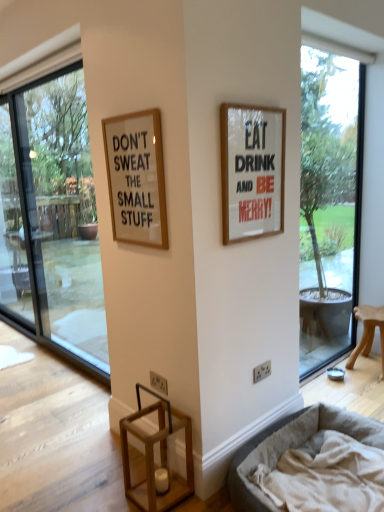
This screenshot has width=384, height=512. Identify the location of free location above transparent glass window at left, positioned as the first window in left-to-right order (from a real-world perspective). click(49, 74).